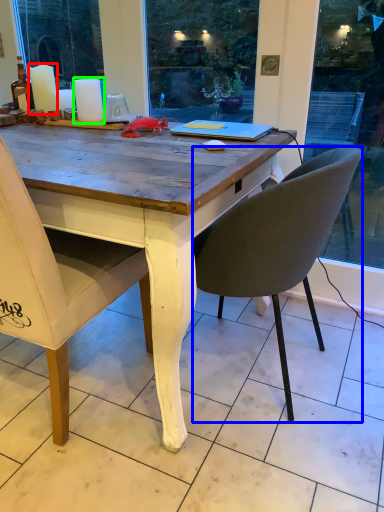
Question: Which is farther away from candle (highlighted by a red box)? chair (highlighted by a blue box) or candle (highlighted by a green box)?

Choices:
 (A) chair
 (B) candle

Answer: (A)